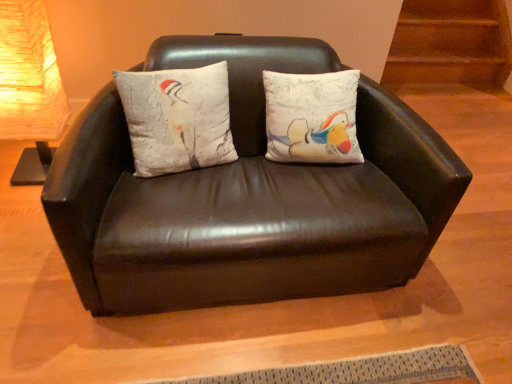
Question: Can you confirm if textured white pillow with bird design at center is positioned to the left of matte black couch at center?

Choices:
 (A) yes
 (B) no

Answer: (A)

Question: Considering the relative sizes of textured white pillow with bird design at center and matte black couch at center in the image provided, is textured white pillow with bird design at center thinner than matte black couch at center?

Choices:
 (A) no
 (B) yes

Answer: (B)

Question: From a real-world perspective, is textured white pillow with bird design at center on top of matte black couch at center?

Choices:
 (A) yes
 (B) no

Answer: (A)

Question: Is textured white pillow with bird design at center not near matte black couch at center?

Choices:
 (A) yes
 (B) no

Answer: (B)

Question: Is textured white pillow with bird design at center positioned with its back to matte black couch at center?

Choices:
 (A) no
 (B) yes

Answer: (B)

Question: Is matte white lampshade at left in front of or behind matte black couch at center in the image?

Choices:
 (A) behind
 (B) front

Answer: (A)

Question: Based on their positions, is matte white lampshade at left located to the left or right of matte black couch at center?

Choices:
 (A) left
 (B) right

Answer: (A)

Question: Is matte white lampshade at left spatially inside matte black couch at center, or outside of it?

Choices:
 (A) outside
 (B) inside

Answer: (A)

Question: Considering the positions of point (36, 137) and point (445, 148), is point (36, 137) closer or farther from the camera than point (445, 148)?

Choices:
 (A) closer
 (B) farther

Answer: (B)

Question: In the image, is matte white lampshade at left positioned in front of or behind textured white pillow with bird design at center?

Choices:
 (A) behind
 (B) front

Answer: (A)

Question: In terms of height, does matte white lampshade at left look taller or shorter compared to textured white pillow with bird design at center?

Choices:
 (A) short
 (B) tall

Answer: (B)

Question: Considering the positions of point (0, 51) and point (173, 109), is point (0, 51) closer or farther from the camera than point (173, 109)?

Choices:
 (A) closer
 (B) farther

Answer: (A)

Question: From a real-world perspective, is matte white lampshade at left physically located above or below textured white pillow with bird design at center?

Choices:
 (A) below
 (B) above

Answer: (A)

Question: From the image's perspective, is matte black couch at center positioned above or below textured white pillow with bird design at center?

Choices:
 (A) above
 (B) below

Answer: (B)

Question: Considering the positions of matte black couch at center and textured white pillow with bird design at center in the image, is matte black couch at center wider or thinner than textured white pillow with bird design at center?

Choices:
 (A) thin
 (B) wide

Answer: (B)